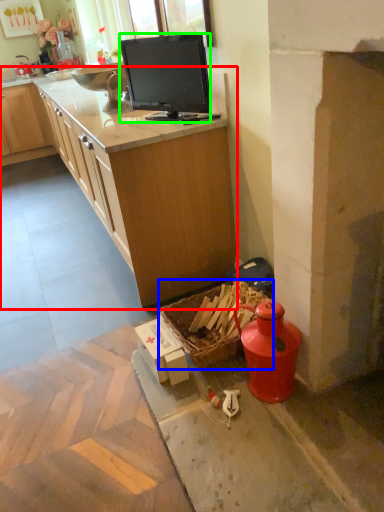
Question: Which object is positioned closest to countertop (highlighted by a red box)? Select from picnic basket (highlighted by a blue box) and television (highlighted by a green box).

Choices:
 (A) picnic basket
 (B) television

Answer: (B)